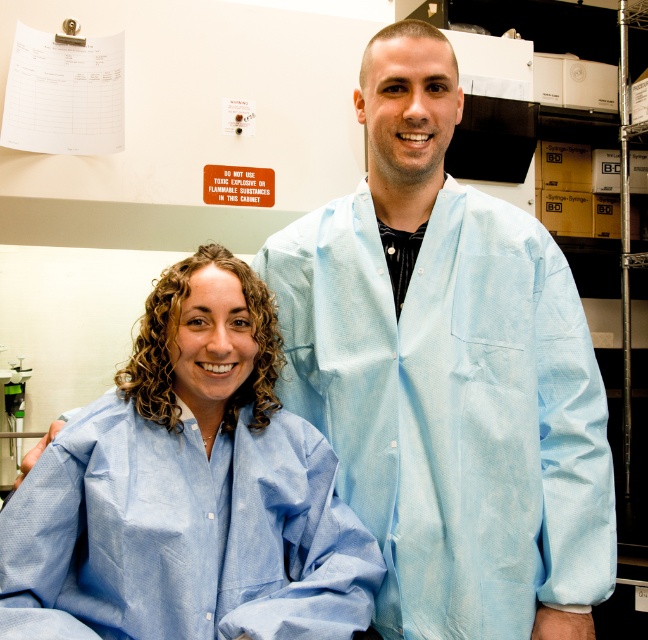
You are a researcher in the lab who needs to adjust the camera position to capture a wider shot of the whiteboard. The current camera position is at point (573, 470). What is the minimum distance you need to move the camera backward to ensure it can capture the entire whiteboard without moving the camera horizontally?

The camera is currently 1.26 meters away from the point. To capture the entire whiteboard in a wider shot without moving horizontally, the camera needs to be moved backward to increase the distance. The minimum distance to move backward would depend on the whiteboard size and desired field of view, but based on standard camera angles, moving back approximately 0.5 meters would provide sufficient space. However, without specific dimensions, a general recommendation is to increase the distance by at least 0.5

You are a researcher in a lab needing to place a 10 inch tool between the light blue fabric lab coat at center and the light blue fabric at center. Can you fit it there?

The light blue fabric lab coat at center and light blue fabric at center are 9.56 inches apart, so the 10 inch tool cannot fit between them as it is slightly longer than the available space.